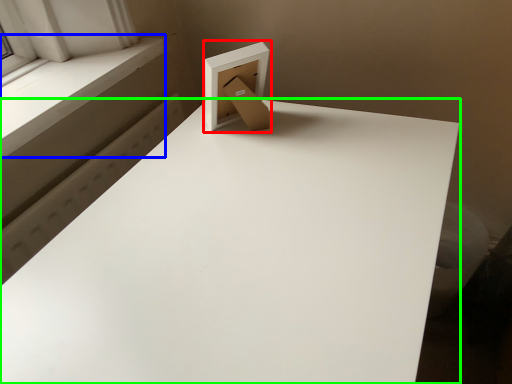
Question: Considering the real-world distances, which object is closest to cardboard box (highlighted by a red box)? window sill (highlighted by a blue box) or table (highlighted by a green box).

Choices:
 (A) window sill
 (B) table

Answer: (B)